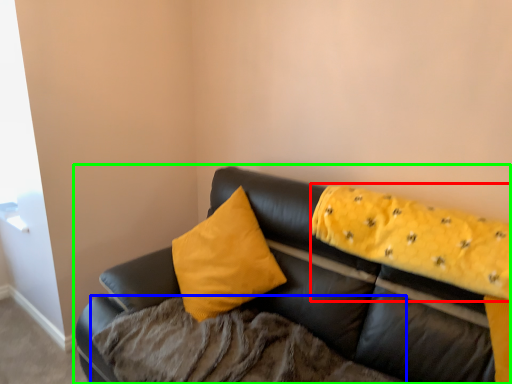
Question: Estimate the real-world distances between objects in this image. Which object is closer to blanket (highlighted by a red box), bedding (highlighted by a blue box) or studio couch (highlighted by a green box)?

Choices:
 (A) bedding
 (B) studio couch

Answer: (B)